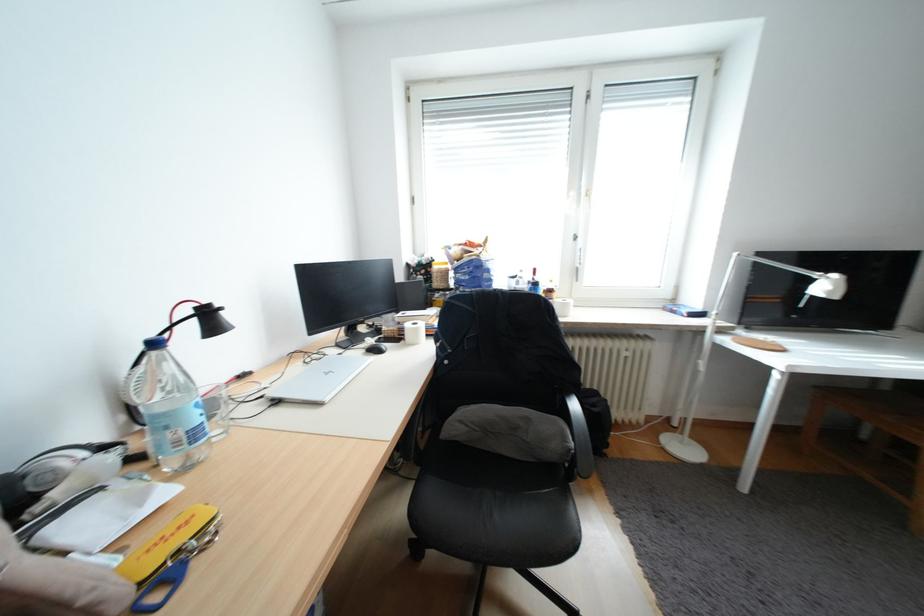
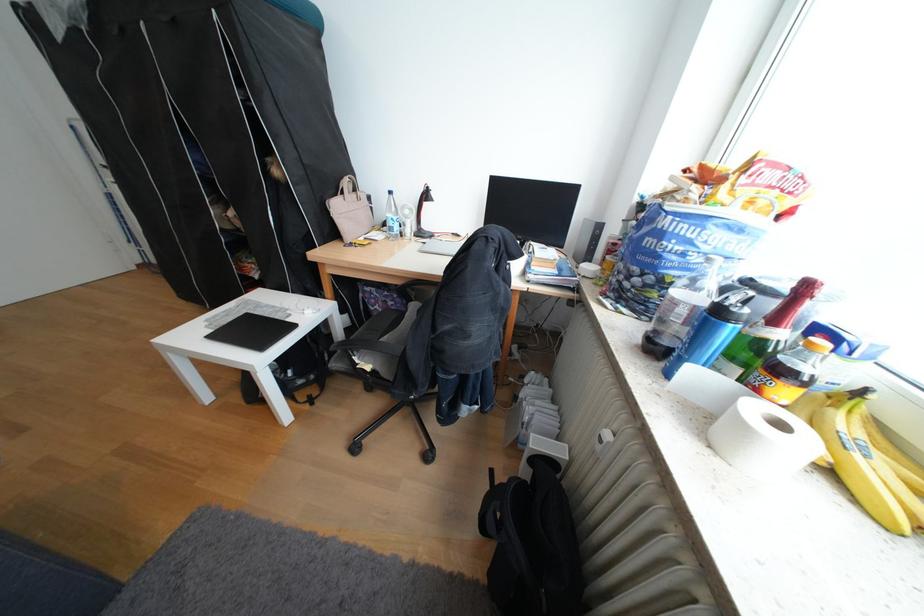
In the second image, find the point that corresponds to point 546,272 in the first image.

(819, 288)